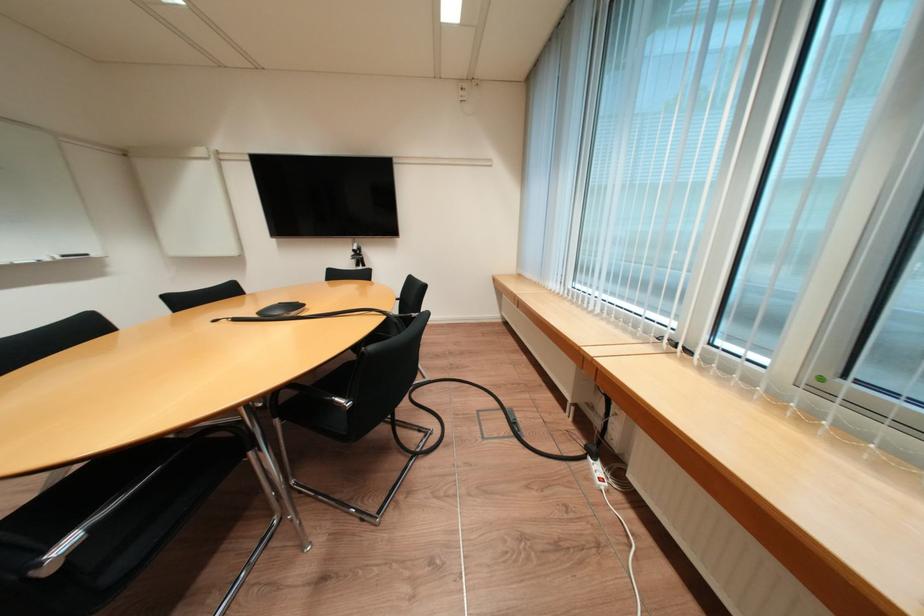
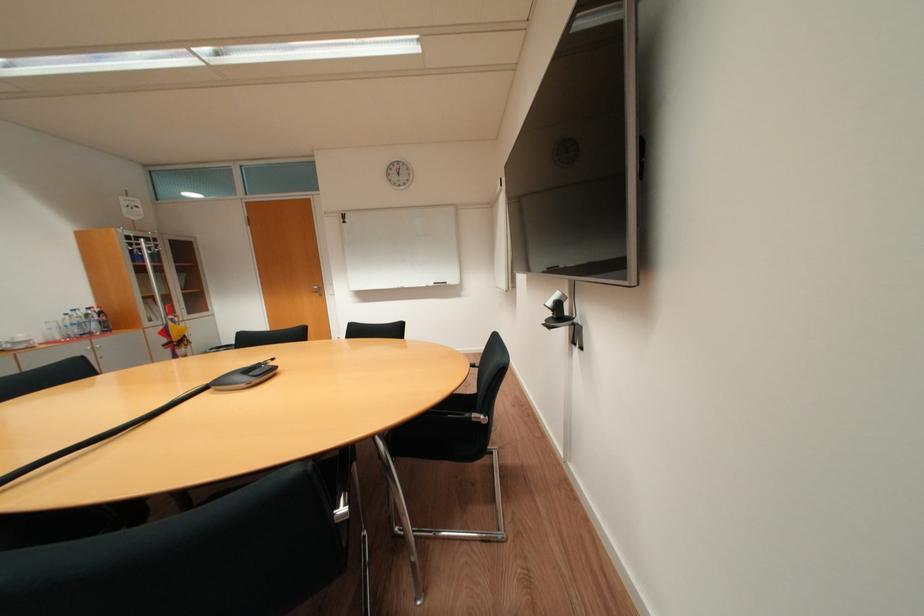
The point at (363, 249) is marked in the first image. Where is the corresponding point in the second image?

(558, 304)